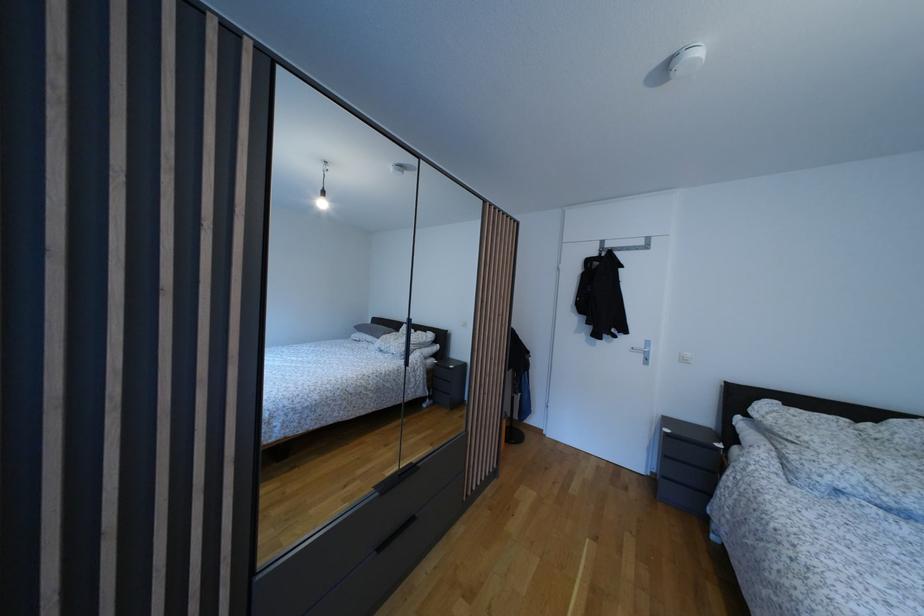
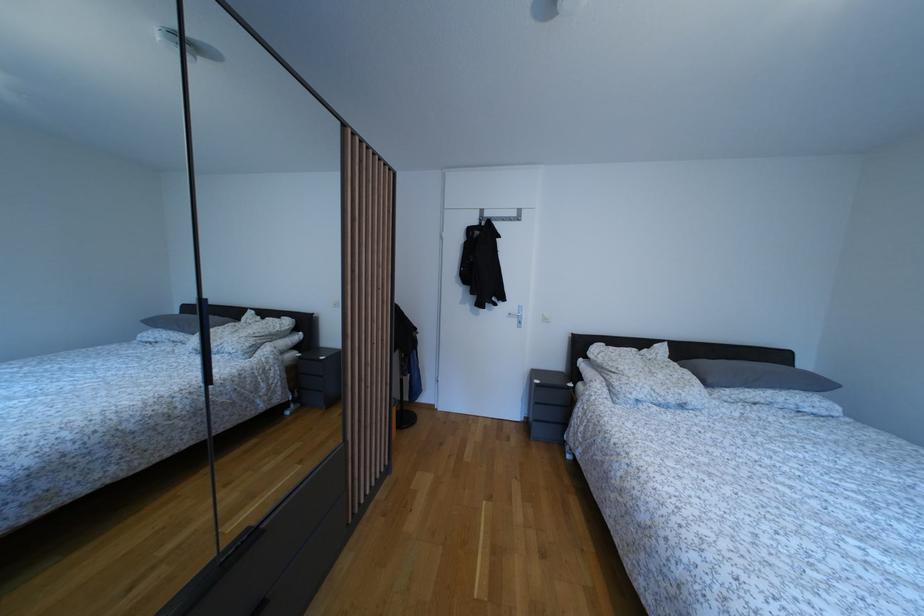
Question: How did the camera likely rotate?

Choices:
 (A) Left
 (B) Right
 (C) Up
 (D) Down

Answer: (B)